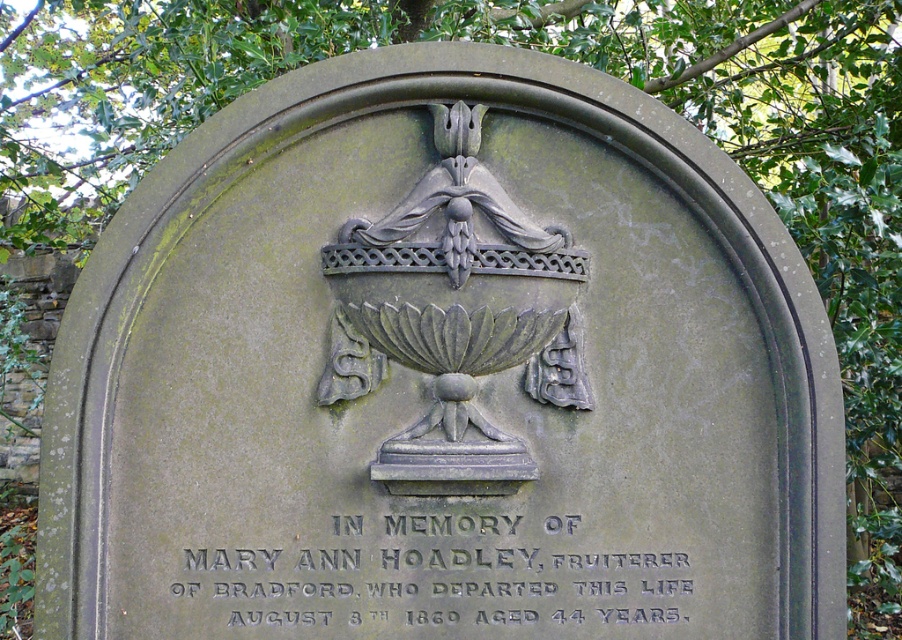
You are examining the memorial plaque and notice two central elements. Which one has a larger size between the black engraved text at center and the dark gray stone urn at center?

The black engraved text at center is bigger than the dark gray stone urn at center.

You are examining the aged stone memorial plaque. The plaque has two central elements, the black engraved text at center and the dark gray stone urn at center. Which of these two elements has a greater width?

The black engraved text at center has a greater width than the dark gray stone urn at center according to the description.